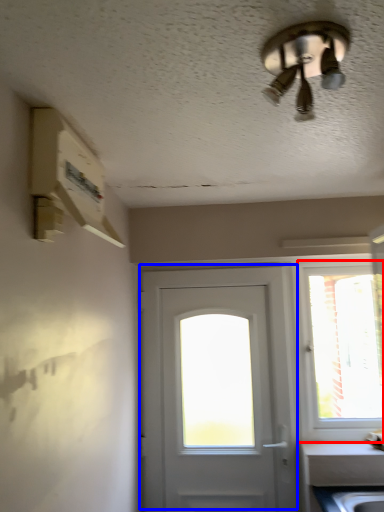
Question: Which object is closer to the camera taking this photo, window (highlighted by a red box) or door (highlighted by a blue box)?

Choices:
 (A) window
 (B) door

Answer: (B)